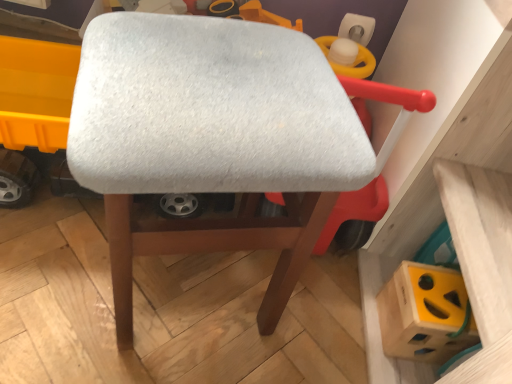
Identify the location of free space underneath textured fabric chair at center (from a real-world perspective). This screenshot has width=512, height=384. coord(194,291).